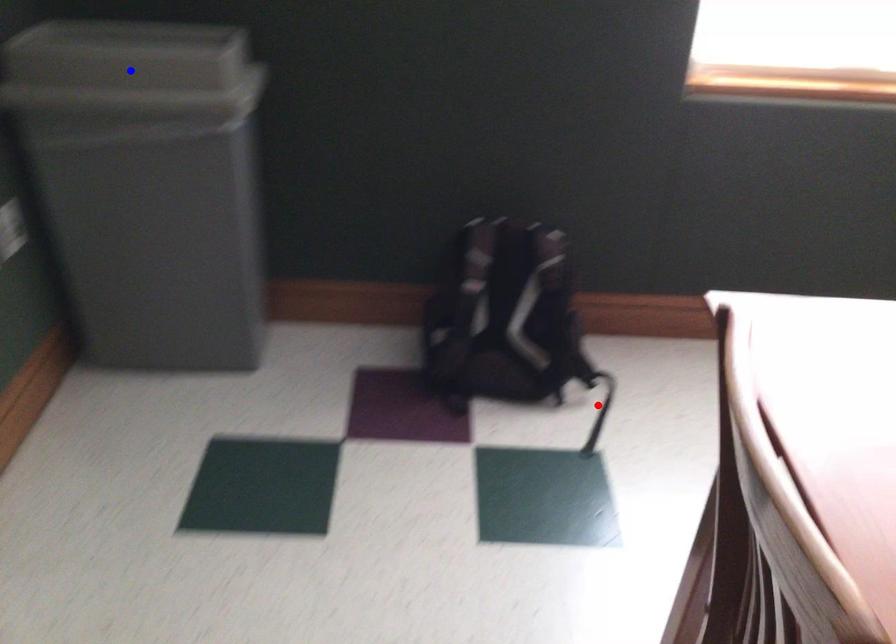
Question: Two points are marked on the image. Which point is closer to the camera?

Choices:
 (A) Blue point is closer.
 (B) Red point is closer.

Answer: (A)